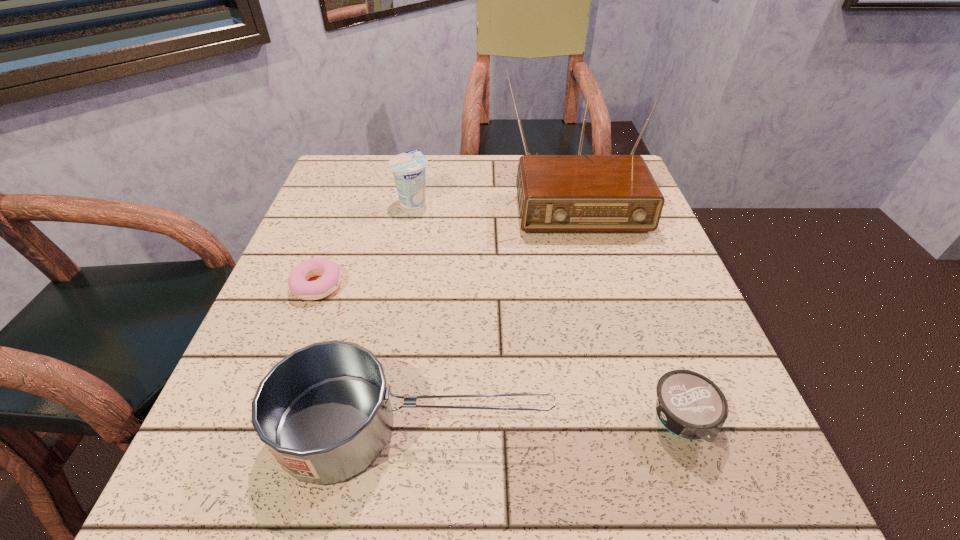
The height and width of the screenshot is (540, 960). In order to click on vacant region between the second shortest object and the pastry in this screenshot , I will do `click(499, 354)`.

You are a GUI agent. You are given a task and a screenshot of the screen. Output one action in this format:
    pyautogui.click(x=<x>, y=<y>)
    Task: Click on the vacant point located between the shorter yogurt and the left yogurt
    
    Given the screenshot: What is the action you would take?
    pyautogui.click(x=547, y=312)

This screenshot has width=960, height=540. Identify the location of free space between the pastry and the fourth tallest object. (499, 354).

The image size is (960, 540). In order to click on free space between the tallest object and the farther yogurt in this screenshot , I will do `click(492, 195)`.

In order to click on vacant region between the radio_receiver and the pastry in this screenshot , I will do `click(444, 238)`.

Identify which object is located as the nearest to the radio_receiver. Please provide its 2D coordinates. Your answer should be formatted as a tuple, i.e. [(x, y)], where the tuple contains the x and y coordinates of a point satisfying the conditions above.

[(408, 168)]

At what (x,y) coordinates should I click in order to perform the action: click on object identified as the closest to the taller yogurt. Please return your answer as a coordinate pair (x, y). The width and height of the screenshot is (960, 540). Looking at the image, I should click on (556, 193).

Where is `vacant point that satisfies the following two spatial constraints: 1. on the front side of the right yogurt; 2. with the handle extending from one side of the saucepan`? The width and height of the screenshot is (960, 540). vacant point that satisfies the following two spatial constraints: 1. on the front side of the right yogurt; 2. with the handle extending from one side of the saucepan is located at coordinates (684, 428).

What are the coordinates of `free space that satisfies the following two spatial constraints: 1. on the front panel of the radio_receiver; 2. on the right side of the nearer yogurt` in the screenshot? It's located at (634, 423).

This screenshot has height=540, width=960. I want to click on vacant area in the image that satisfies the following two spatial constraints: 1. on the front panel of the tallest object; 2. with the handle extending from one side of the saucepan, so coord(636,428).